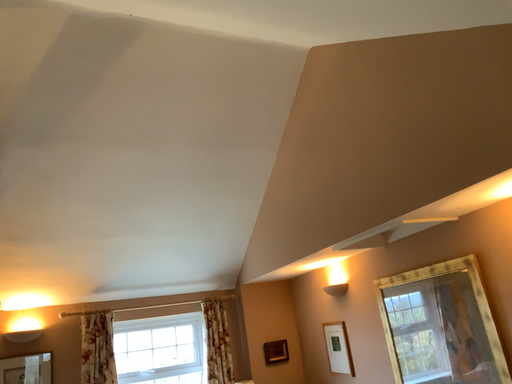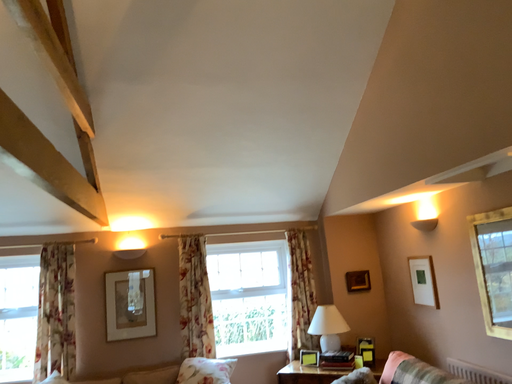
Question: How did the camera likely rotate when shooting the video?

Choices:
 (A) rotated downward
 (B) rotated upward

Answer: (A)